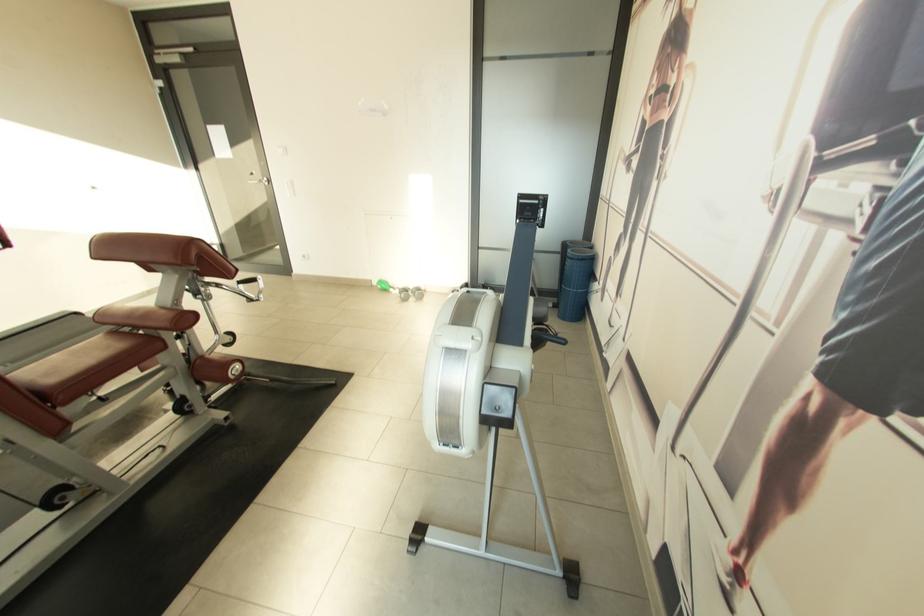
Find the location of a particular element. The width and height of the screenshot is (924, 616). padded seat surface is located at coordinates (84, 358).